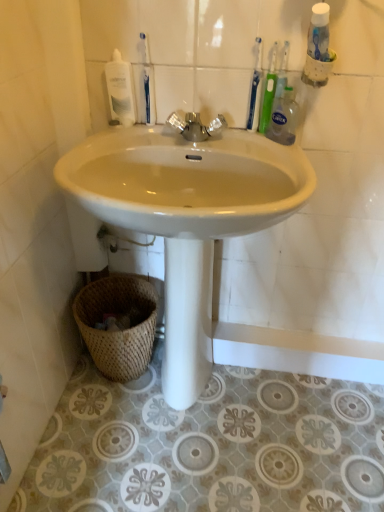
This screenshot has width=384, height=512. What are the coordinates of `free space that is in between silver metallic faucet at center and blue plastic toothbrush at upper right, the second toothbrush positioned from the left` in the screenshot? It's located at (231, 139).